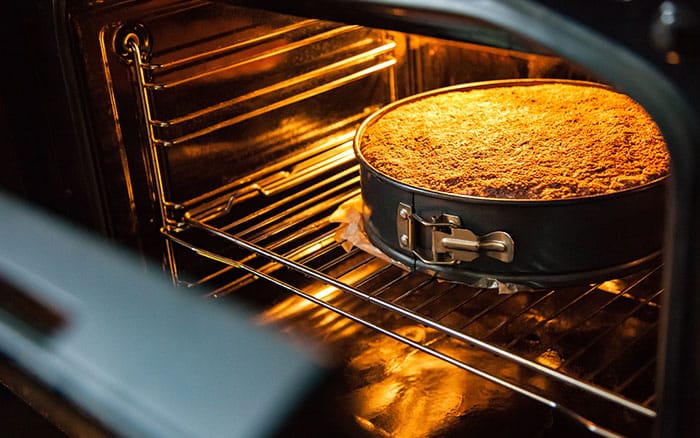
The height and width of the screenshot is (438, 700). Identify the location of light shining on bottom of oven. (442, 395).